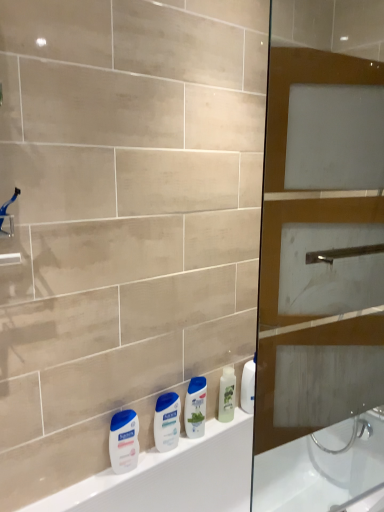
Question: In the image, is blue glossy shampoo at center on the left side or the right side of blue plastic shower head at upper left?

Choices:
 (A) left
 (B) right

Answer: (B)

Question: From the image's perspective, is blue glossy shampoo at center located above or below blue plastic shower head at upper left?

Choices:
 (A) below
 (B) above

Answer: (A)

Question: Based on their relative distances, which object is nearer to the brown glass screen door at right?

Choices:
 (A) white glossy lotion at center, arranged as the second toiletry when viewed from the right
 (B) blue plastic shower head at upper left
 (C) white matte lotion at lower left, which ranks as the 1th toiletry in left-to-right order
 (D) white glossy lotion at center, the first toiletry viewed from the back
 (E) blue glossy shampoo at center

Answer: (D)

Question: Estimate the real-world distances between objects in this image. Which object is farther from the white glossy lotion at center, the first toiletry viewed from the back?

Choices:
 (A) white glossy lotion at center, which appears as the 2th toiletry when viewed from the left
 (B) brown glass screen door at right
 (C) blue glossy shampoo at center
 (D) blue plastic shower head at upper left
 (E) white matte lotion at lower left, the third toiletry when ordered from back to front

Answer: (D)